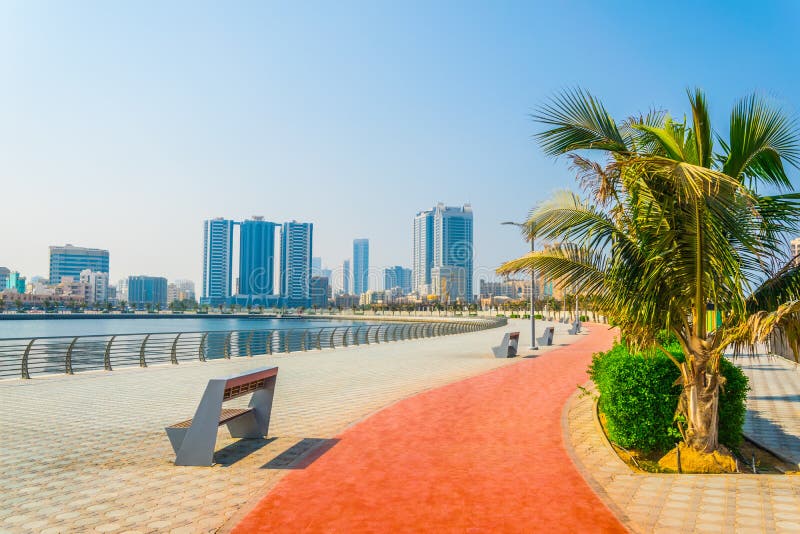
Identify the location of second closest bench. The width and height of the screenshot is (800, 534). (506, 342).